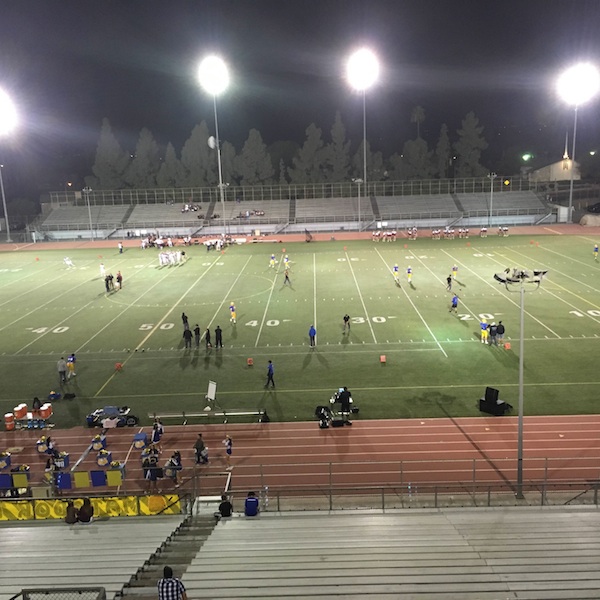
Identify the location of bench. The image size is (600, 600). (251, 415), (201, 416).